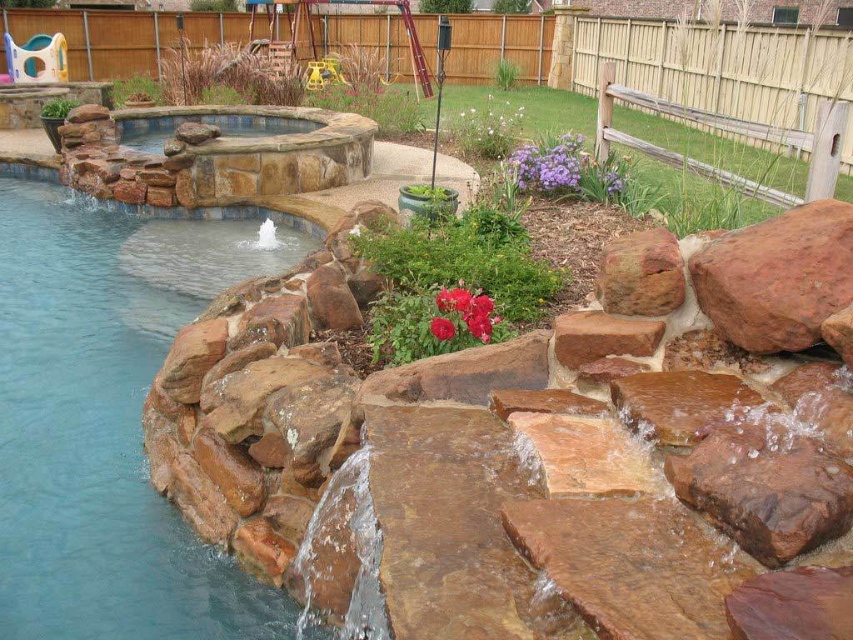
Question: Is rustic brown rock at right smaller than purple matte flower at upper center?

Choices:
 (A) no
 (B) yes

Answer: (B)

Question: Which object is farther from the camera taking this photo?

Choices:
 (A) red matte flower at center
 (B) purple matte flower at upper center

Answer: (B)

Question: Among these objects, which one is nearest to the camera?

Choices:
 (A) red matte flower at center
 (B) brown stone pond at left
 (C) purple matte flower at upper center
 (D) rustic brown rock at right

Answer: (D)

Question: Which point is farther to the camera?

Choices:
 (A) rustic brown rock at right
 (B) red matte flower at center
 (C) bright red petals at center

Answer: (C)

Question: Is the position of purple matte flower at upper center less distant than that of red matte flower at center?

Choices:
 (A) no
 (B) yes

Answer: (A)

Question: Can you confirm if rustic brown rock at right is positioned to the right of bright red petals at center?

Choices:
 (A) no
 (B) yes

Answer: (B)